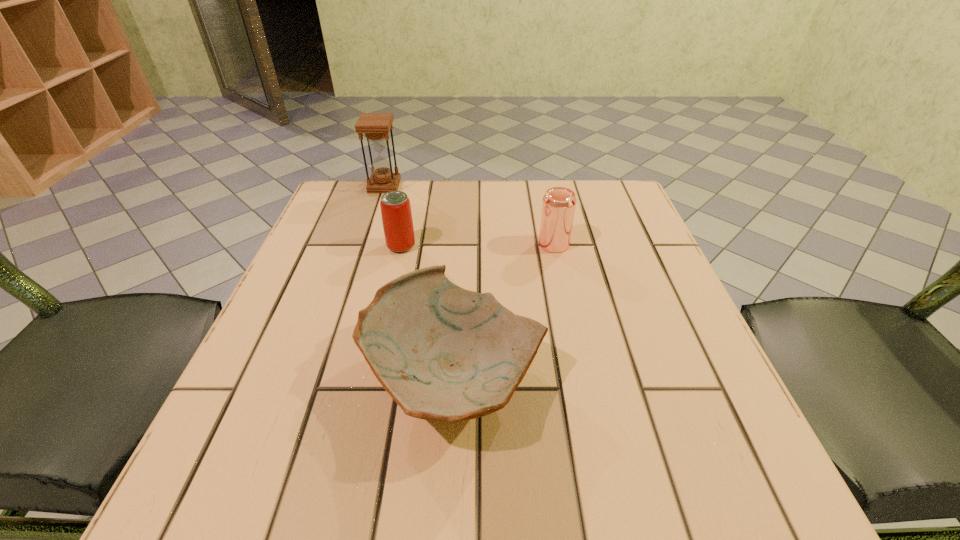
At what (x,y) coordinates should I click in order to perform the action: click on object at the near edge. Please return your answer as a coordinate pair (x, y). The width and height of the screenshot is (960, 540). Looking at the image, I should click on (443, 353).

The image size is (960, 540). What are the coordinates of `object that is at the left edge` in the screenshot? It's located at (376, 126).

Find the location of a particular element. object at the far left corner is located at coordinates (376, 126).

This screenshot has width=960, height=540. I want to click on free space at the far edge, so click(442, 195).

At what (x,y) coordinates should I click in order to perform the action: click on free space at the near edge of the desktop. Please return your answer as a coordinate pair (x, y). The height and width of the screenshot is (540, 960). Looking at the image, I should click on (345, 445).

At what (x,y) coordinates should I click in order to perform the action: click on free space at the left edge. Please return your answer as a coordinate pair (x, y). Looking at the image, I should click on (314, 337).

Where is `free region at the right edge of the desktop`? The image size is (960, 540). free region at the right edge of the desktop is located at coordinates (624, 310).

Find the location of a particular element. vacant area at the far left corner is located at coordinates (336, 194).

Identify the location of vacant space at the near left corner of the desktop. The height and width of the screenshot is (540, 960). (211, 482).

Identify the location of vacant space at the far right corner of the desktop. (601, 198).